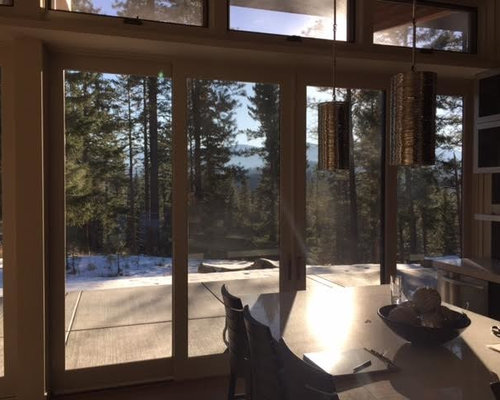
The image size is (500, 400). What are the coordinates of `fruit bowl` in the screenshot? It's located at (420, 320).